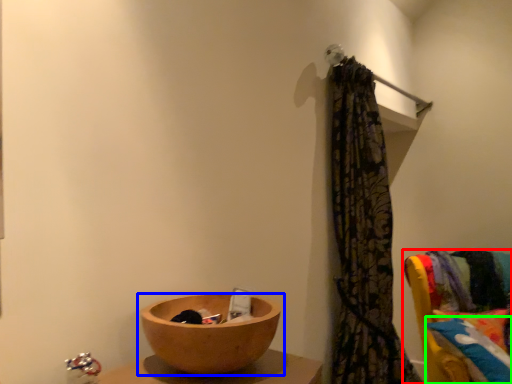
Question: Considering the real-world distances, which object is farthest from furniture (highlighted by a red box)? tableware (highlighted by a blue box) or pillow (highlighted by a green box)?

Choices:
 (A) tableware
 (B) pillow

Answer: (A)